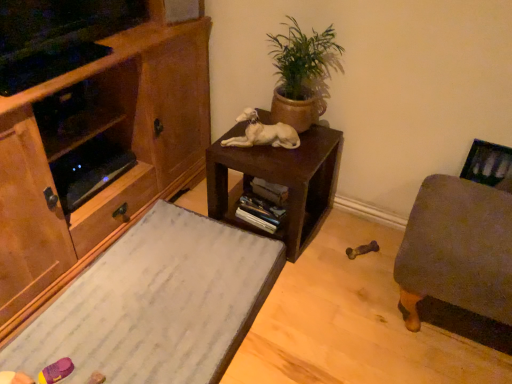
The width and height of the screenshot is (512, 384). Find the location of `free point below white glossy statue at center (from a real-world perspective)`. free point below white glossy statue at center (from a real-world perspective) is located at coordinates (266, 141).